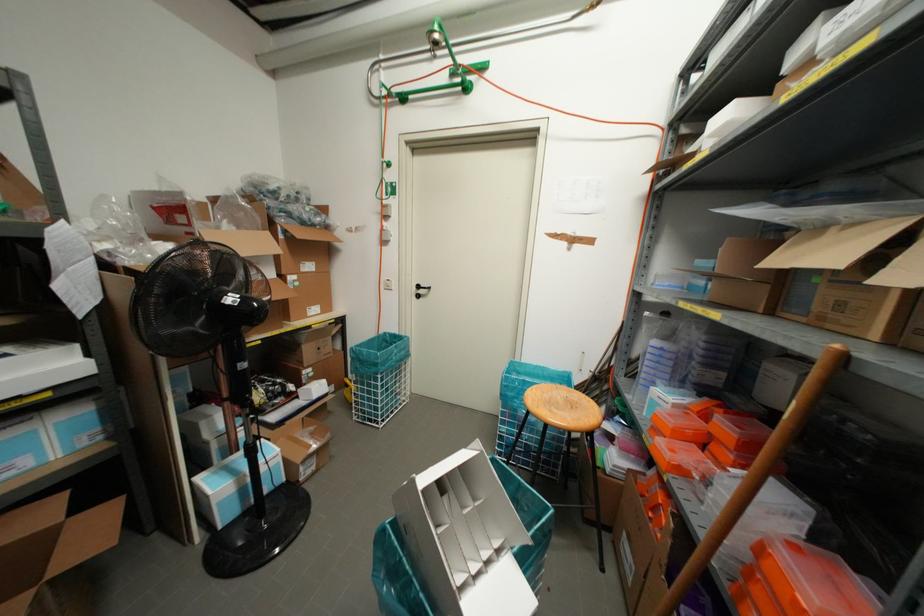
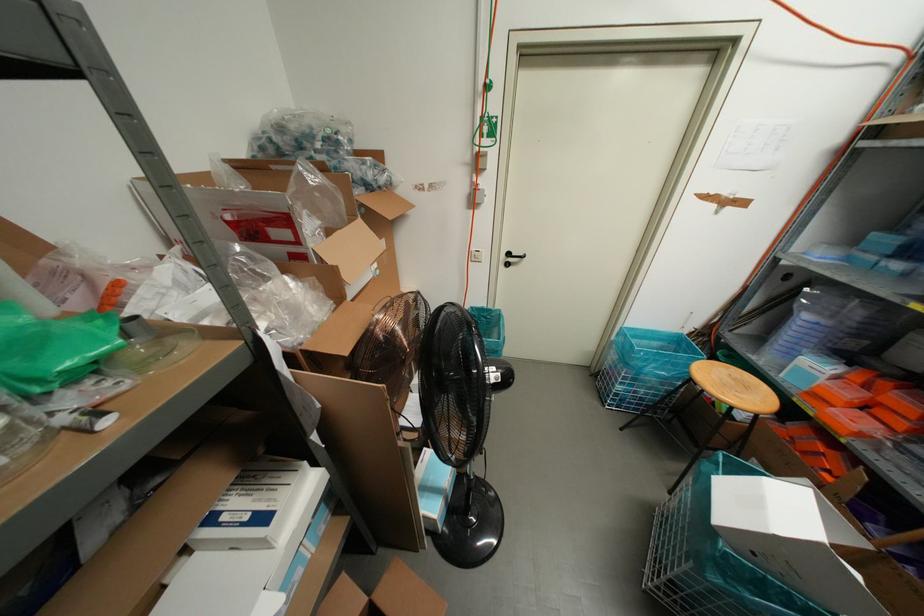
In the second image, find the point that corresponds to pixel 418 296 in the first image.

(506, 264)